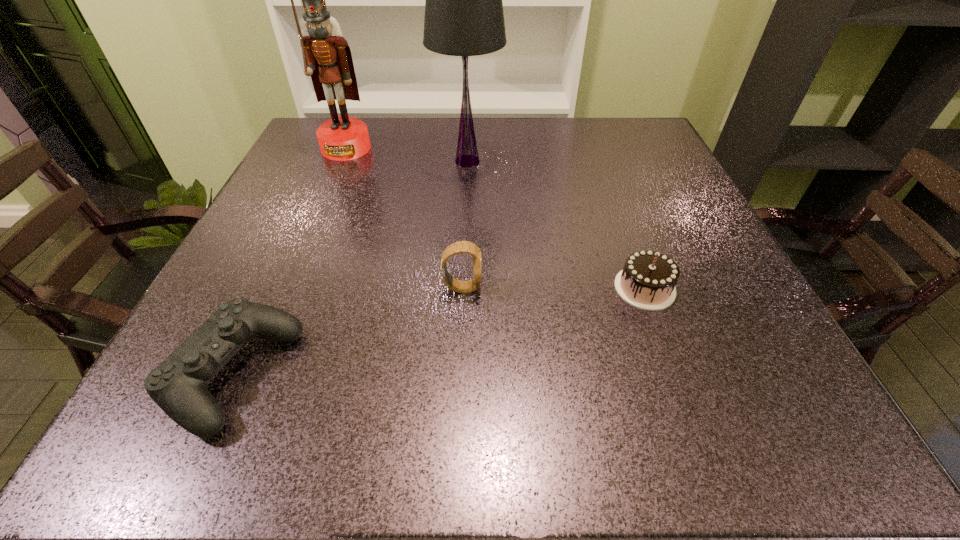
The width and height of the screenshot is (960, 540). I want to click on nutcracker, so (327, 58).

Find the location of a particular element. the second tallest object is located at coordinates (464, 16).

What are the coordinates of `watch` in the screenshot? It's located at (465, 247).

The image size is (960, 540). In order to click on chocolate cake in this screenshot , I will do `click(647, 281)`.

The image size is (960, 540). Identify the location of the nearest object. (178, 385).

Locate an element on the screen. This screenshot has width=960, height=540. free space located 0.330m on the front-facing side of the nutcracker is located at coordinates (302, 251).

Where is `free space located 0.300m on the front-facing side of the second tallest object`? free space located 0.300m on the front-facing side of the second tallest object is located at coordinates (463, 272).

This screenshot has width=960, height=540. I want to click on vacant region located 0.130m on the face of the third shortest object, so click(x=556, y=288).

I want to click on free spot located 0.200m on the front of the chocolate cake, so click(694, 423).

This screenshot has width=960, height=540. Find the location of `blank space located 0.280m on the back of the nearest object`. blank space located 0.280m on the back of the nearest object is located at coordinates (305, 216).